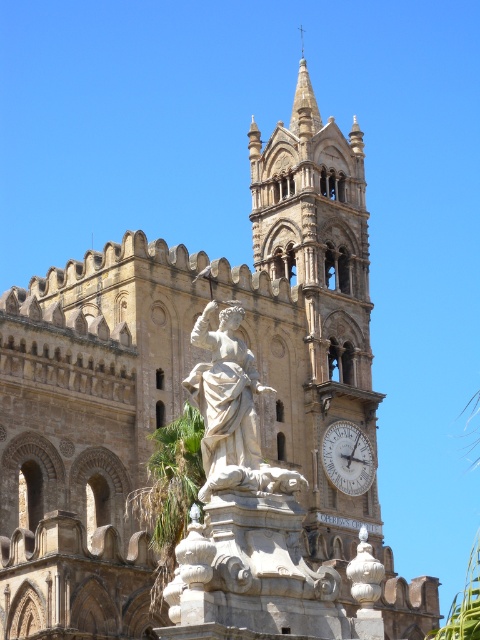
Between point (301, 301) and point (302, 56), which one is positioned in front?

Point (301, 301) is in front.

Who is taller, stone clock tower at center or smooth stone spire at upper center?

With more height is stone clock tower at center.

Locate an element on the screen. The height and width of the screenshot is (640, 480). stone clock tower at center is located at coordinates (320, 316).

Who is positioned more to the right, white marble statue at center or smooth stone spire at upper center?

smooth stone spire at upper center

Who is higher up, white marble statue at center or smooth stone spire at upper center?

smooth stone spire at upper center is above.

Between point (233, 440) and point (300, 38), which one is positioned behind?

The point (300, 38) is more distant.

The height and width of the screenshot is (640, 480). Identify the location of white marble statue at center. (231, 410).

Is stone clock tower at center smaller than white marble clock at upper center?

Incorrect, stone clock tower at center is not smaller in size than white marble clock at upper center.

Does stone clock tower at center have a greater height compared to white marble clock at upper center?

Indeed, stone clock tower at center has a greater height compared to white marble clock at upper center.

Between point (373, 451) and point (363, 460), which one is positioned behind?

Point (373, 451)

This screenshot has height=640, width=480. Find the location of `stone clock tower at center`. stone clock tower at center is located at coordinates (320, 316).